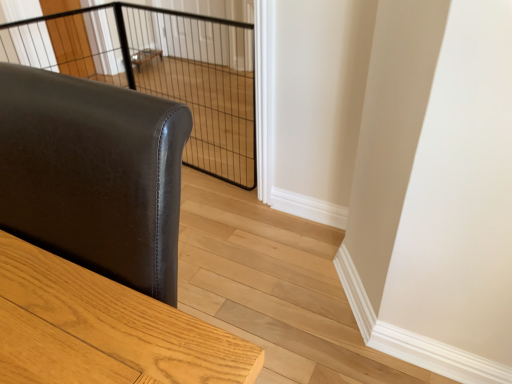
Question: Should I look upward or downward to see black wire mesh cage at upper center?

Choices:
 (A) up
 (B) down

Answer: (A)

Question: In which direction should I rotate to look at clear glass screen door at upper center, marked as the 2th screen door in a left-to-right arrangement?

Choices:
 (A) right
 (B) left

Answer: (B)

Question: Can we say clear wire mesh at upper left, marked as the 2th screen door in a right-to-left arrangement, lies outside matte black leather sofa at left?

Choices:
 (A) no
 (B) yes

Answer: (B)

Question: From the image's perspective, does clear wire mesh at upper left, which ranks as the first screen door in left-to-right order, appear lower than matte black leather sofa at left?

Choices:
 (A) no
 (B) yes

Answer: (A)

Question: Is clear wire mesh at upper left, which ranks as the first screen door in left-to-right order, smaller than matte black leather sofa at left?

Choices:
 (A) yes
 (B) no

Answer: (A)

Question: Does clear wire mesh at upper left, marked as the 2th screen door in a right-to-left arrangement, have a lesser width compared to matte black leather sofa at left?

Choices:
 (A) no
 (B) yes

Answer: (B)

Question: Is clear wire mesh at upper left, which ranks as the first screen door in left-to-right order, aimed at matte black leather sofa at left?

Choices:
 (A) no
 (B) yes

Answer: (A)

Question: Is clear wire mesh at upper left, which ranks as the first screen door in left-to-right order, taller than matte black leather sofa at left?

Choices:
 (A) no
 (B) yes

Answer: (A)

Question: Does clear glass screen door at upper center, which is the 1th screen door in right-to-left order, have a smaller size compared to black wire mesh cage at upper center?

Choices:
 (A) yes
 (B) no

Answer: (A)

Question: Would you say black wire mesh cage at upper center is part of clear glass screen door at upper center, marked as the 2th screen door in a left-to-right arrangement,'s contents?

Choices:
 (A) yes
 (B) no

Answer: (B)

Question: Would you say clear glass screen door at upper center, marked as the 2th screen door in a left-to-right arrangement, is outside black wire mesh cage at upper center?

Choices:
 (A) yes
 (B) no

Answer: (A)

Question: From the image's perspective, is clear glass screen door at upper center, marked as the 2th screen door in a left-to-right arrangement, above black wire mesh cage at upper center?

Choices:
 (A) yes
 (B) no

Answer: (A)

Question: Considering the relative sizes of clear glass screen door at upper center, which is the 1th screen door in right-to-left order, and black wire mesh cage at upper center in the image provided, is clear glass screen door at upper center, which is the 1th screen door in right-to-left order, shorter than black wire mesh cage at upper center?

Choices:
 (A) yes
 (B) no

Answer: (A)

Question: Is clear glass screen door at upper center, marked as the 2th screen door in a left-to-right arrangement, oriented away from black wire mesh cage at upper center?

Choices:
 (A) yes
 (B) no

Answer: (B)

Question: Can you confirm if matte black leather sofa at left is shorter than clear wire mesh at upper left, marked as the 2th screen door in a right-to-left arrangement?

Choices:
 (A) no
 (B) yes

Answer: (A)